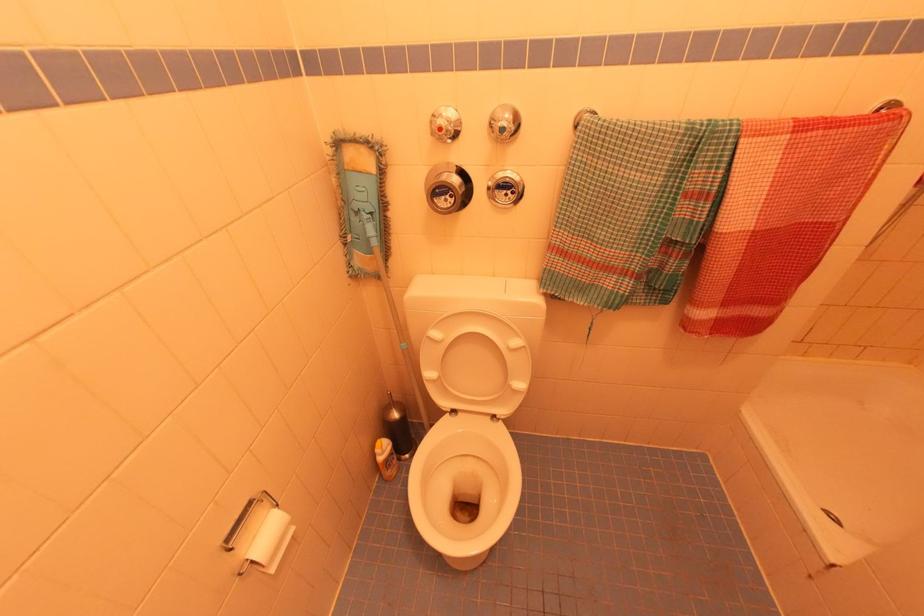
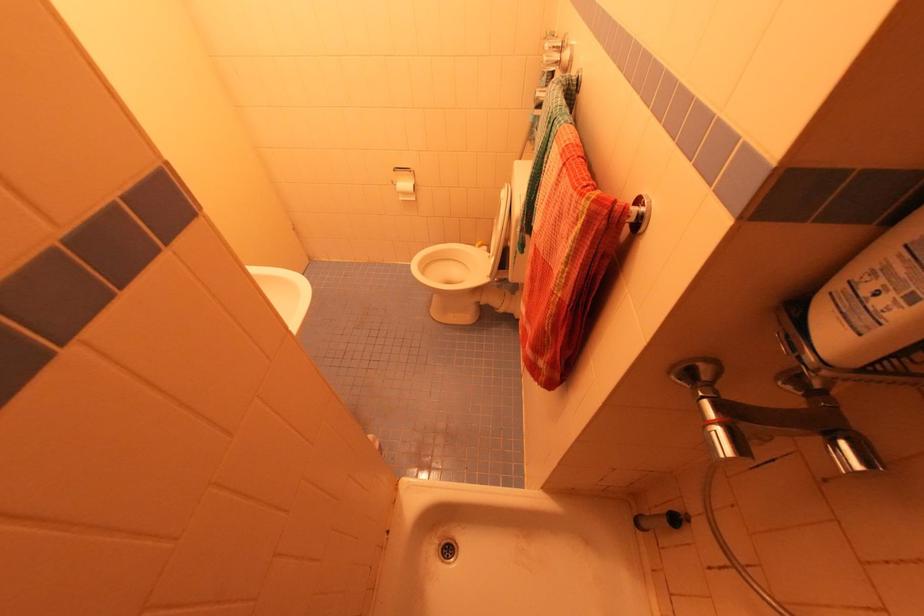
Find the pixel in the second image that matches the point at 274,570 in the first image.

(403, 200)